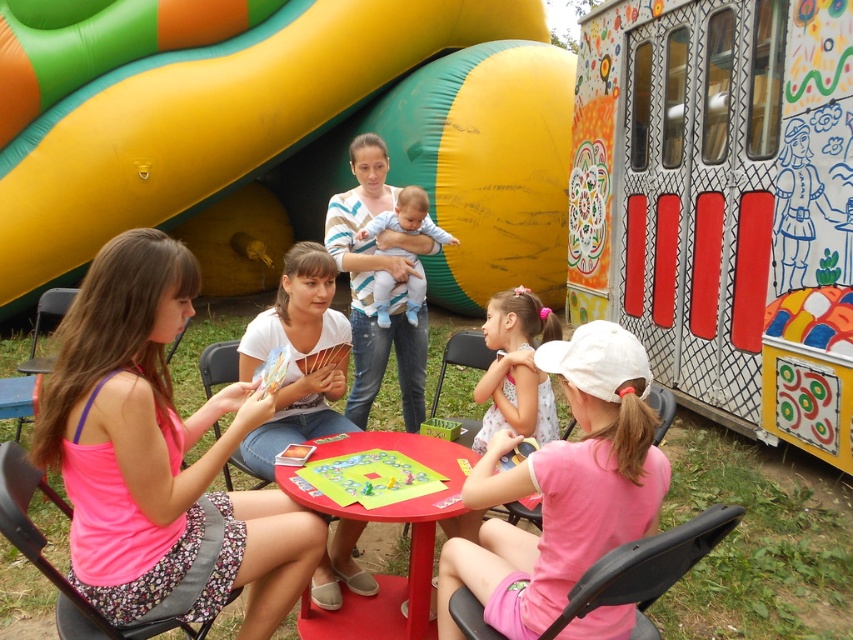
Which is in front, point (637, 497) or point (422, 484)?

Positioned in front is point (637, 497).

In order to click on pink fabric dress at lower center in this screenshot , I will do [561, 488].

Who is more forward, [614,497] or [374,477]?

Positioned in front is point [614,497].

What are the coordinates of `pink fabric dress at lower center` in the screenshot? It's located at (561, 488).

Can you confirm if yellow rubber slide at upper left is wider than light blue cotton baby at center?

Indeed, yellow rubber slide at upper left has a greater width compared to light blue cotton baby at center.

Between yellow rubber slide at upper left and light blue cotton baby at center, which one appears on the left side from the viewer's perspective?

From the viewer's perspective, yellow rubber slide at upper left appears more on the left side.

Between point (97, 228) and point (410, 321), which one is positioned behind?

Positioned behind is point (97, 228).

Locate an element on the screen. The image size is (853, 640). yellow rubber slide at upper left is located at coordinates (277, 132).

Does smooth plastic table at center have a larger size compared to green matte board game at center?

Indeed, smooth plastic table at center has a larger size compared to green matte board game at center.

What do you see at coordinates (386, 522) in the screenshot?
I see `smooth plastic table at center` at bounding box center [386, 522].

What do you see at coordinates (386, 522) in the screenshot?
I see `smooth plastic table at center` at bounding box center [386, 522].

In order to click on smooth plastic table at center in this screenshot , I will do `click(386, 522)`.